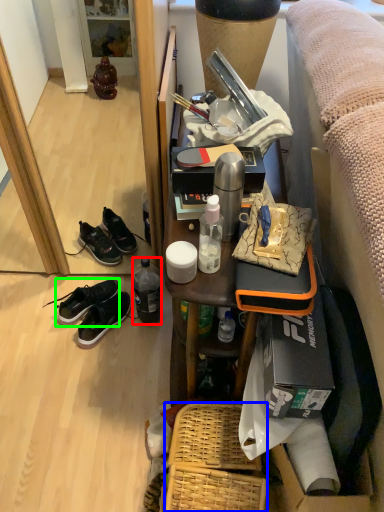
Question: Which is farther away from bottle (highlighted by a red box)? picnic basket (highlighted by a blue box) or shoe (highlighted by a green box)?

Choices:
 (A) picnic basket
 (B) shoe

Answer: (A)